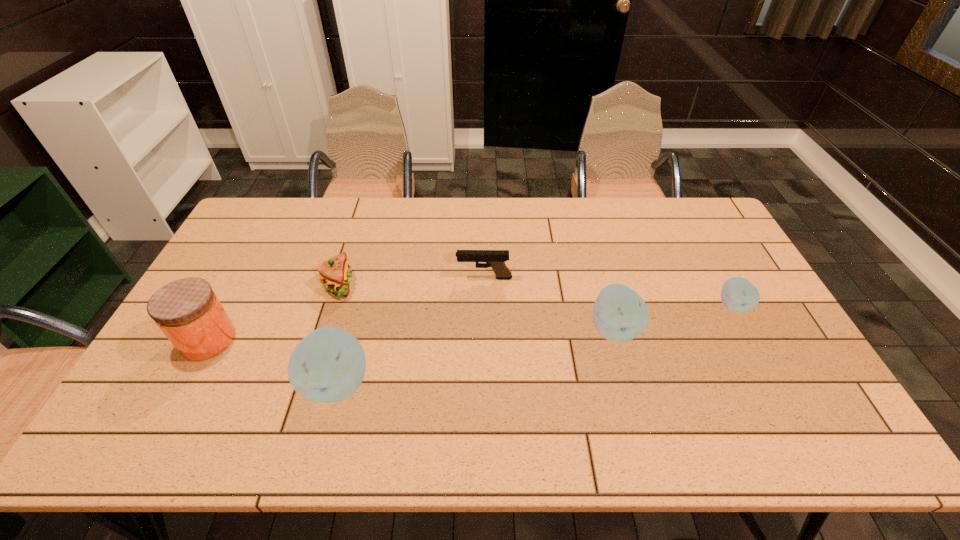
You are a GUI agent. You are given a task and a screenshot of the screen. Output one action in this format:
    pyautogui.click(x=<x>, y=<y>)
    Task: Click on the vacant space at the right edge of the desktop
    This screenshot has height=540, width=960.
    Given the screenshot: What is the action you would take?
    pyautogui.click(x=692, y=244)

Find the location of a particular element. This screenshot has width=960, height=540. free point at the far left corner is located at coordinates [265, 207].

Locate an element on the screen. This screenshot has width=960, height=540. free space between the rightmost object and the jar is located at coordinates (470, 323).

Where is `vacant region between the rightmost object and the jar`? vacant region between the rightmost object and the jar is located at coordinates (470, 323).

Locate an element on the screen. The width and height of the screenshot is (960, 540). free spot between the sandwich and the jar is located at coordinates (274, 312).

Where is `vacant area between the fifth object from left to right and the jar`? vacant area between the fifth object from left to right and the jar is located at coordinates (411, 334).

Find the location of a particular element. vacant region between the pistol and the second apple from right to left is located at coordinates (549, 303).

Find the location of a particular element. vacant region between the rightmost apple and the sandwich is located at coordinates tap(536, 295).

Where is `free spot between the nearest apple and the leftmost object`? free spot between the nearest apple and the leftmost object is located at coordinates (273, 361).

At what (x,y) coordinates should I click in order to perform the action: click on unoccupied position between the leftmost object and the second object from right to left. Please return your answer as a coordinate pair (x, y). The width and height of the screenshot is (960, 540). Looking at the image, I should click on coord(411,334).